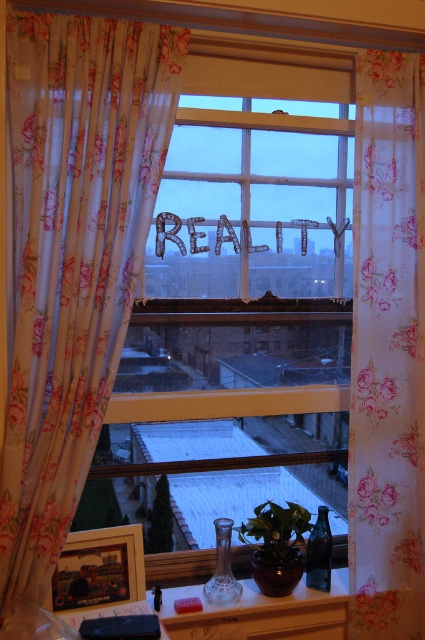
Question: Which is farther from the floral sheer curtain at right?

Choices:
 (A) matte glass vase at lower center
 (B) green matte plant at center
 (C) floral fabric curtain at center

Answer: (C)

Question: Which of the following is the closest to the observer?

Choices:
 (A) floral sheer curtain at right
 (B) matte glass vase at lower center
 (C) floral fabric curtain at center
 (D) green matte plant at center

Answer: (C)

Question: Does floral sheer curtain at right have a larger size compared to green matte plant at center?

Choices:
 (A) yes
 (B) no

Answer: (A)

Question: Is floral sheer curtain at right to the right of matte glass vase at lower center from the viewer's perspective?

Choices:
 (A) yes
 (B) no

Answer: (A)

Question: Considering the relative positions of floral fabric curtain at center and floral sheer curtain at right in the image provided, where is floral fabric curtain at center located with respect to floral sheer curtain at right?

Choices:
 (A) right
 (B) left

Answer: (B)

Question: Which of the following is the closest to the observer?

Choices:
 (A) green matte plant at center
 (B) matte glass vase at lower center
 (C) floral fabric curtain at center
 (D) floral sheer curtain at right

Answer: (C)